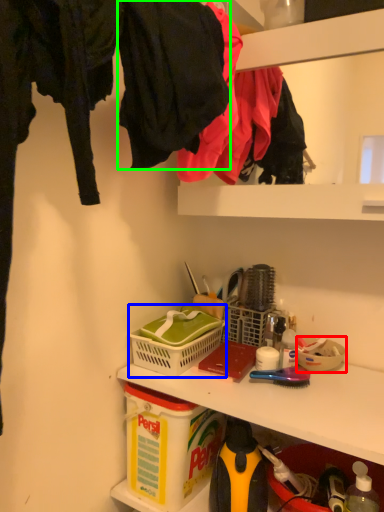
Question: Estimate the real-world distances between objects in this image. Which object is farther from bowl (highlighted by a red box), picnic basket (highlighted by a blue box) or clothing (highlighted by a green box)?

Choices:
 (A) picnic basket
 (B) clothing

Answer: (B)